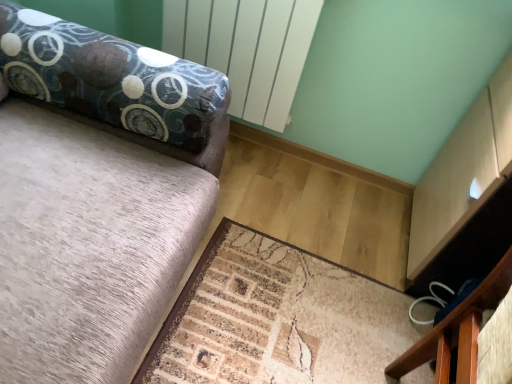
Question: Is black fabric drawer at lower right not inside beige textured mat at lower center?

Choices:
 (A) yes
 (B) no

Answer: (A)

Question: Could you tell me if black fabric drawer at lower right is facing beige textured mat at lower center?

Choices:
 (A) yes
 (B) no

Answer: (B)

Question: From a real-world perspective, is black fabric drawer at lower right located beneath beige textured mat at lower center?

Choices:
 (A) yes
 (B) no

Answer: (B)

Question: Is black fabric drawer at lower right to the left of beige textured mat at lower center from the viewer's perspective?

Choices:
 (A) no
 (B) yes

Answer: (A)

Question: Is the position of black fabric drawer at lower right more distant than that of beige textured mat at lower center?

Choices:
 (A) yes
 (B) no

Answer: (A)

Question: From a real-world perspective, is black fabric drawer at lower right on top of beige textured mat at lower center?

Choices:
 (A) no
 (B) yes

Answer: (B)

Question: Is beige textured mat at lower center smaller than black fabric drawer at lower right?

Choices:
 (A) yes
 (B) no

Answer: (B)

Question: Does beige textured mat at lower center have a greater height compared to black fabric drawer at lower right?

Choices:
 (A) no
 (B) yes

Answer: (A)

Question: From a real-world perspective, is beige textured mat at lower center on top of black fabric drawer at lower right?

Choices:
 (A) yes
 (B) no

Answer: (B)

Question: Is beige textured mat at lower center closer to camera compared to black fabric drawer at lower right?

Choices:
 (A) yes
 (B) no

Answer: (A)

Question: Is beige textured mat at lower center at the left side of black fabric drawer at lower right?

Choices:
 (A) yes
 (B) no

Answer: (A)

Question: Is beige textured mat at lower center next to black fabric drawer at lower right and touching it?

Choices:
 (A) no
 (B) yes

Answer: (A)

Question: Would you say beige textured mat at lower center is to the left or to the right of black fabric drawer at lower right in the picture?

Choices:
 (A) right
 (B) left

Answer: (B)